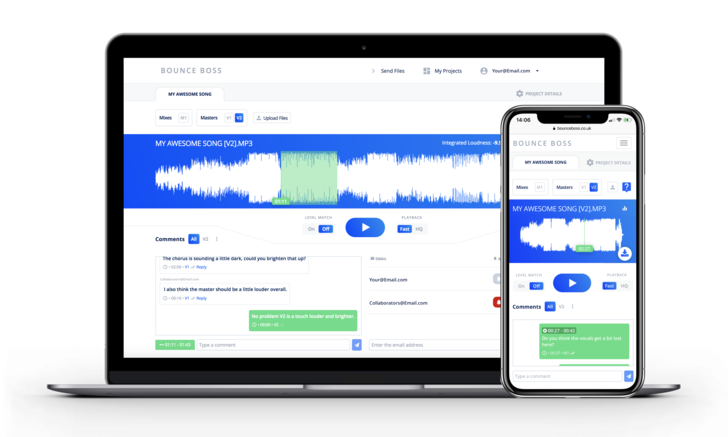
Where is `bottom of laptop`? The width and height of the screenshot is (728, 437). bottom of laptop is located at coordinates (266, 388).